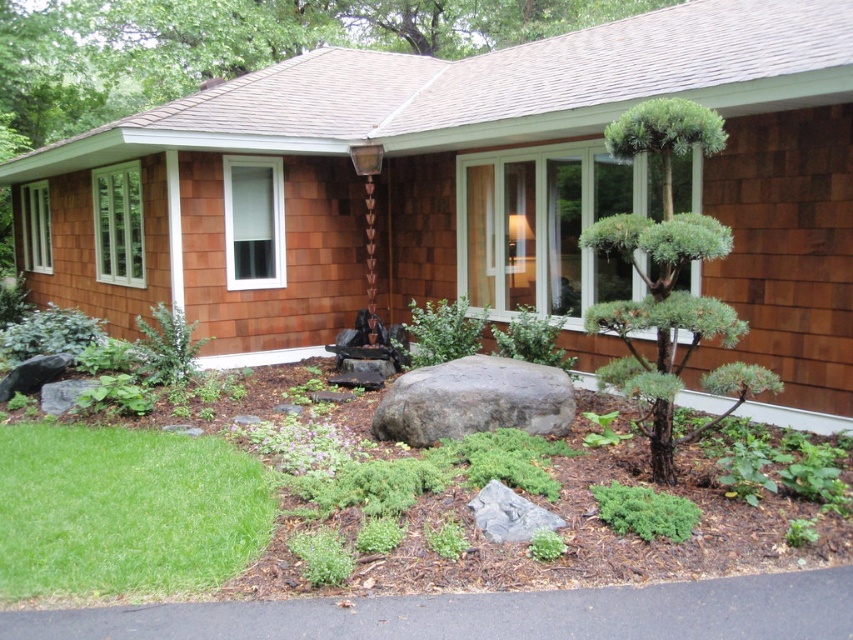
Consider the image. Does green grass at lower left appear on the right side of green needle-like at center?

No, green grass at lower left is not to the right of green needle-like at center.

At what (x,y) coordinates should I click in order to perform the action: click on green grass at lower left. Please return your answer as a coordinate pair (x, y). Looking at the image, I should click on (363, 506).

Does point (653, 497) lie in front of point (630, 147)?

Yes, it is.

Identify the location of green grass at lower left. (363, 506).

Between point (398, 516) and point (541, 369), which one is positioned behind?

The point (541, 369) is behind.

Is green grass at lower left smaller than gray rough boulder at center?

Correct, green grass at lower left occupies less space than gray rough boulder at center.

Does point (589, 458) come farther from viewer compared to point (566, 413)?

No, (589, 458) is in front of (566, 413).

Where is `green grass at lower left`? green grass at lower left is located at coordinates (363, 506).

Which is in front, point (727, 243) or point (373, 413)?

Positioned in front is point (727, 243).

Is green needle-like at center bigger than gray rough boulder at center?

Yes.

Is point (608, 136) closer to viewer compared to point (456, 371)?

Yes, point (608, 136) is in front of point (456, 371).

This screenshot has height=640, width=853. In order to click on green needle-like at center in this screenshot , I will do `click(666, 280)`.